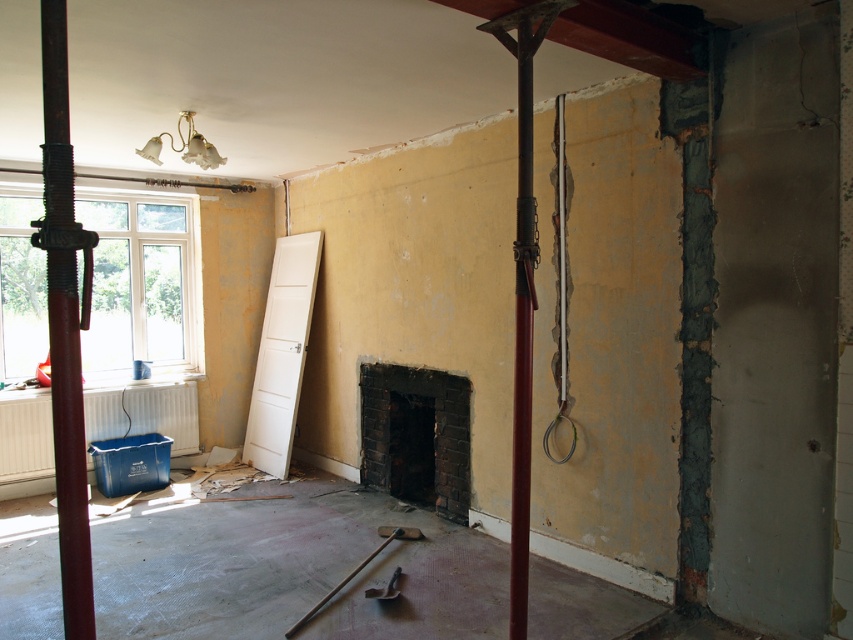
Question: Which object appears closest to the camera in this image?

Choices:
 (A) metallic silver hammer at center
 (B) rusty metal pole at left

Answer: (B)

Question: Which object appears closest to the camera in this image?

Choices:
 (A) rusty metal pole at left
 (B) metallic silver hammer at center
 (C) black brick fireplace at center

Answer: (A)

Question: Is black brick fireplace at center behind metallic red pole at right?

Choices:
 (A) yes
 (B) no

Answer: (A)

Question: Which object is the farthest from the black brick fireplace at center?

Choices:
 (A) metallic silver hammer at center
 (B) rusty metal pole at left

Answer: (B)

Question: Does rusty metal pole at left come in front of metallic silver hammer at center?

Choices:
 (A) yes
 (B) no

Answer: (A)

Question: Is black brick fireplace at center below metallic silver hammer at center?

Choices:
 (A) yes
 (B) no

Answer: (B)